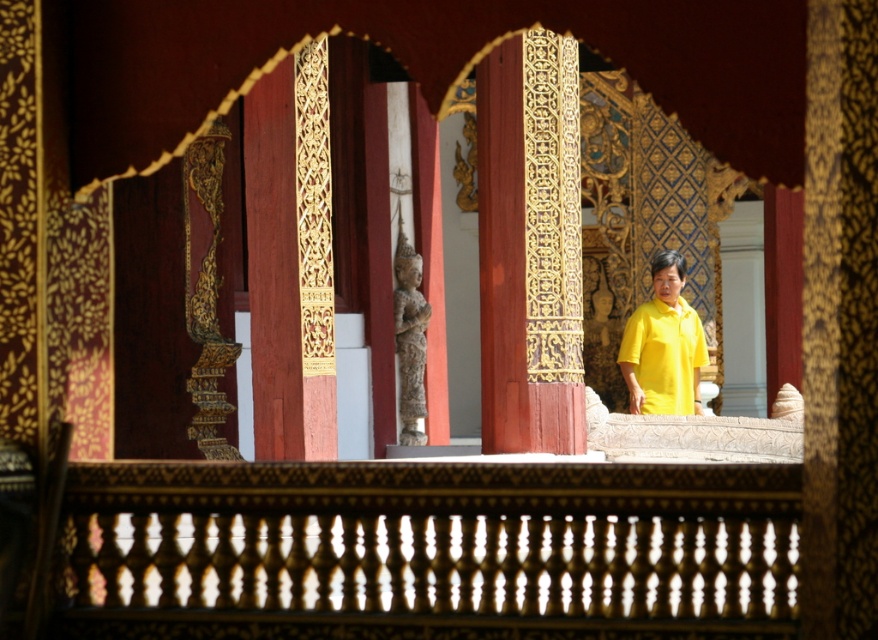
Measure the distance between wooden carved rail at center and camera.

wooden carved rail at center and camera are 88.83 feet apart from each other.

Is wooden carved rail at center bigger than yellow matte shirt at center?

No, wooden carved rail at center is not bigger than yellow matte shirt at center.

Does point (739, 500) come in front of point (674, 355)?

Yes, it is in front of point (674, 355).

Identify the location of wooden carved rail at center. Image resolution: width=878 pixels, height=640 pixels. (430, 550).